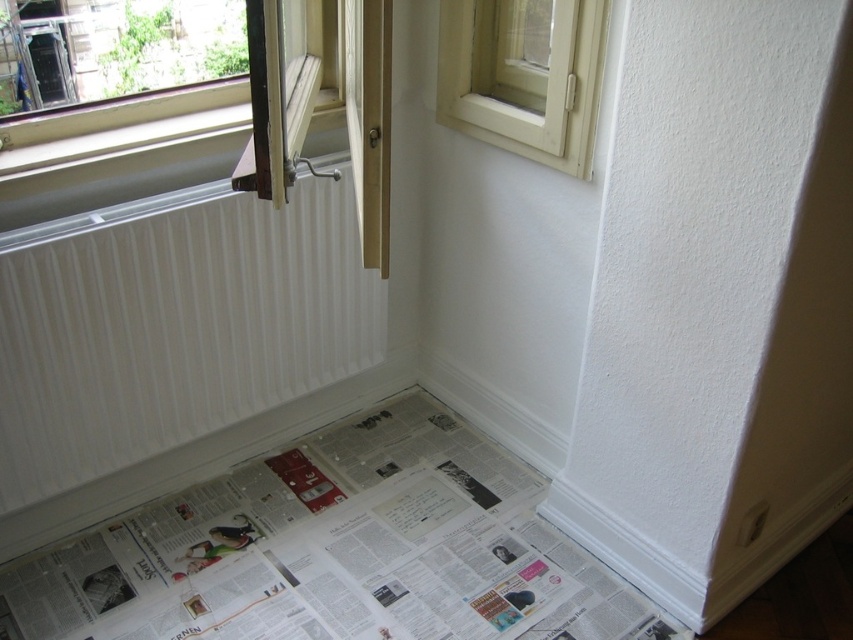
Does point (335, 509) come in front of point (137, 324)?

That is False.

Is point (142, 618) behind point (70, 259)?

That is True.

At what (x,y) coordinates should I click in order to perform the action: click on white printed newspaper at lower left. Please return your answer as a coordinate pair (x, y). This screenshot has width=853, height=640. Looking at the image, I should click on (337, 550).

Can you confirm if white ribbed radiator at lower left is positioned to the left of white plastic window at upper right?

Indeed, white ribbed radiator at lower left is positioned on the left side of white plastic window at upper right.

Looking at this image, who is lower down, white ribbed radiator at lower left or white plastic window at upper right?

white ribbed radiator at lower left is below.

Who is more forward, (x=229, y=340) or (x=465, y=52)?

Point (x=465, y=52) is more forward.

In order to click on white ribbed radiator at lower left in this screenshot , I will do `click(172, 324)`.

Is point (107, 552) more distant than point (509, 112)?

Yes.

Describe the element at coordinates (337, 550) in the screenshot. I see `white printed newspaper at lower left` at that location.

Which is in front, point (521, 580) or point (598, 44)?

Point (598, 44) is more forward.

Where is `white printed newspaper at lower left`? white printed newspaper at lower left is located at coordinates (337, 550).